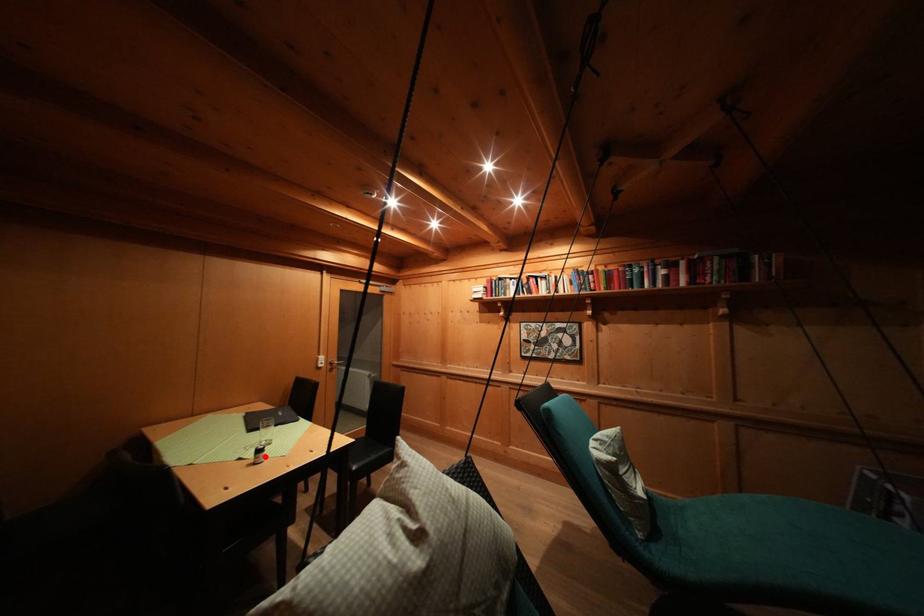
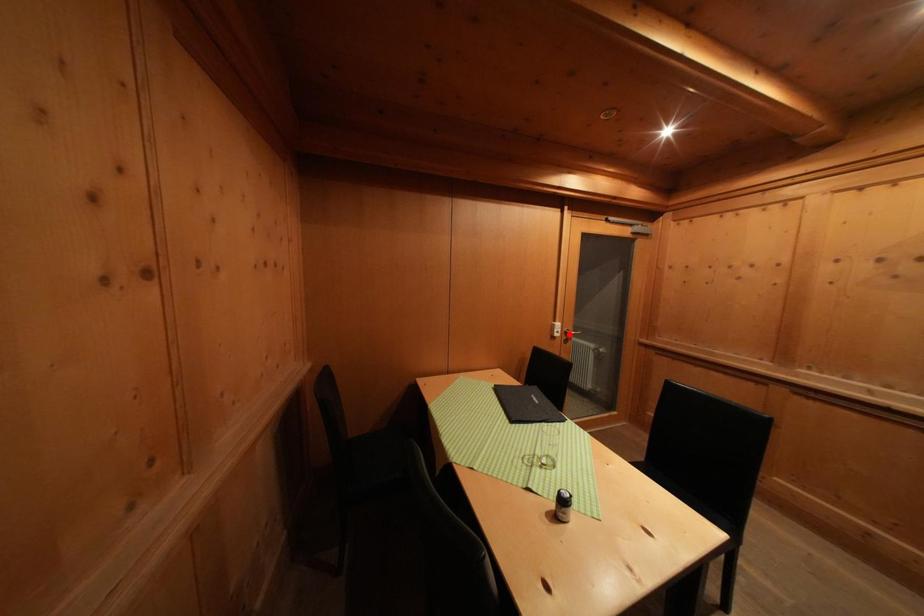
I am providing you with two images of the same scene from different viewpoints. A red point is marked on the first image and another point is marked on the second image. Do the highlighted points in image1 and image2 indicate the same real-world spot?

No